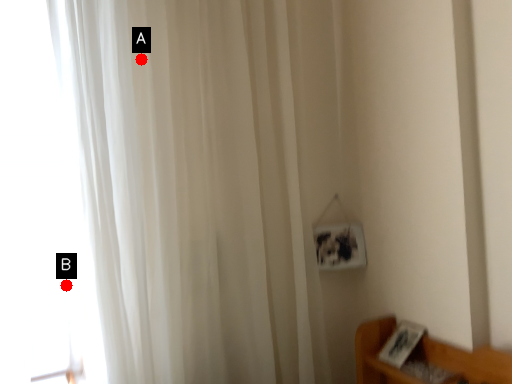
Question: Two points are circled on the image, labeled by A and B beside each circle. Which point is closer to the camera taking this photo?

Choices:
 (A) A is closer
 (B) B is closer

Answer: (A)